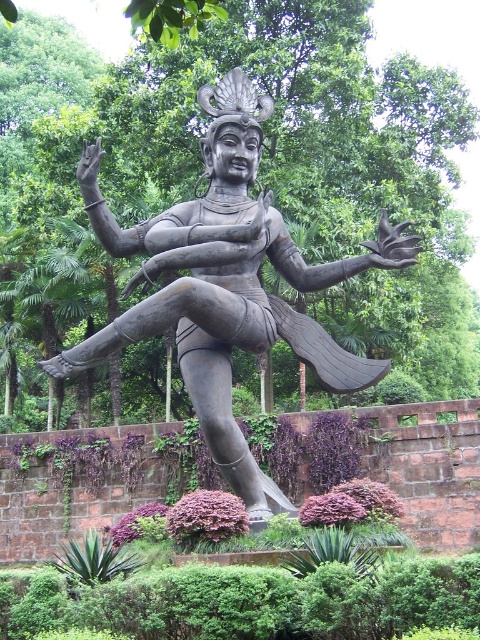
Question: Is bronze statue at center above green leafy plants at center?

Choices:
 (A) yes
 (B) no

Answer: (A)

Question: Among these objects, which one is nearest to the camera?

Choices:
 (A) bronze statue at center
 (B) green leafy plants at center

Answer: (B)

Question: Does bronze statue at center appear over green leafy plants at center?

Choices:
 (A) no
 (B) yes

Answer: (B)

Question: Is bronze statue at center thinner than green leafy plants at center?

Choices:
 (A) no
 (B) yes

Answer: (B)

Question: Among these points, which one is farthest from the camera?

Choices:
 (A) (31, 483)
 (B) (200, 412)

Answer: (A)